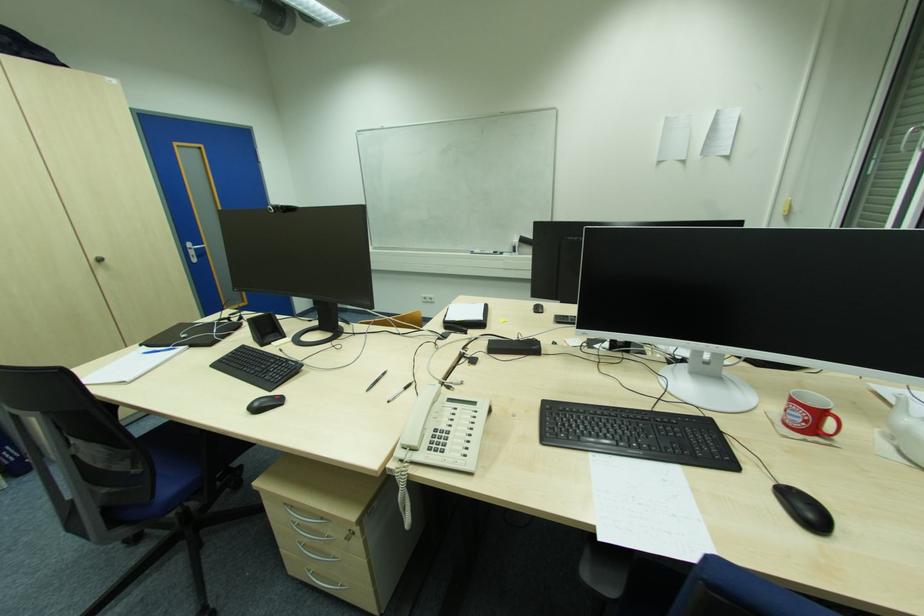
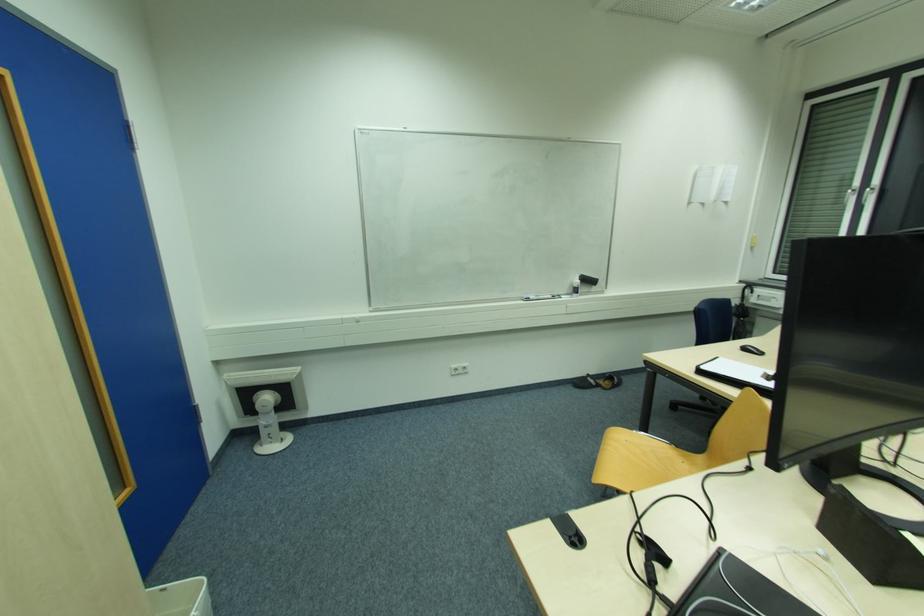
In the second image, find the point that corresponds to point (485, 132) in the first image.

(550, 158)